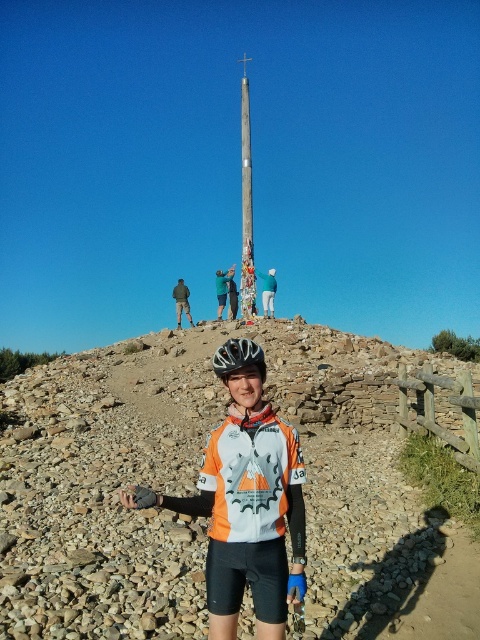
What do you see at coordinates (194, 481) in the screenshot? The height and width of the screenshot is (640, 480). I see `rough stone hillside at center` at bounding box center [194, 481].

Identify the location of rough stone hillside at center. The image size is (480, 640). (194, 481).

Does wooden pole at center come behind matte black helmet at center?

Yes, it is.

Who is shorter, wooden pole at center or matte black helmet at center?

matte black helmet at center

Which is behind, point (247, 92) or point (264, 378)?

Positioned behind is point (247, 92).

Identify the location of wooden pole at center. (247, 202).

Is point (101, 589) closer to camera compared to point (252, 253)?

Yes, point (101, 589) is in front of point (252, 253).

Who is positioned more to the left, rough stone hillside at center or wooden pole at center?

wooden pole at center is more to the left.

Describe the element at coordinates (194, 481) in the screenshot. I see `rough stone hillside at center` at that location.

Find the location of a particular element. rough stone hillside at center is located at coordinates (194, 481).